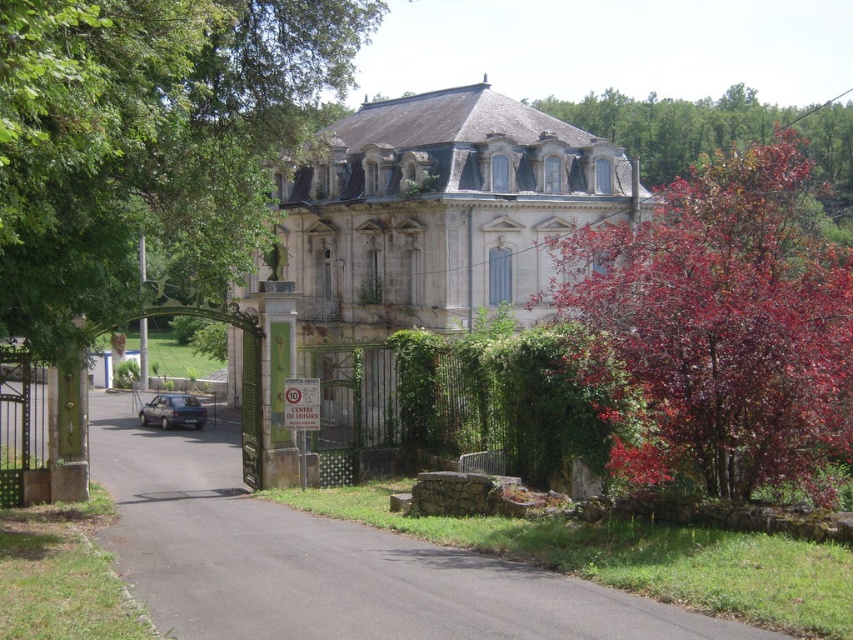
Who is more forward, (22, 276) or (183, 412)?

Positioned in front is point (22, 276).

Does green leafy tree at upper left have a lesser width compared to slate gray metallic hatchback at lower left?

Incorrect, green leafy tree at upper left's width is not less than slate gray metallic hatchback at lower left's.

Which is behind, point (38, 225) or point (141, 413)?

Point (141, 413)

Find the location of a particular element. Image resolution: width=853 pixels, height=640 pixels. green leafy tree at upper left is located at coordinates (148, 140).

Does point (199, 456) lie in front of point (194, 401)?

Yes, it is.

Is black asphalt driveway at center shorter than slate gray metallic hatchback at lower left?

Correct, black asphalt driveway at center is not as tall as slate gray metallic hatchback at lower left.

Who is more distant from viewer, (410, 630) or (181, 397)?

The point (181, 397) is behind.

This screenshot has width=853, height=640. In order to click on black asphalt driveway at center in this screenshot , I will do tap(328, 561).

Does green leafy tree at upper left have a greater height compared to purple leafy tree at upper right?

In fact, green leafy tree at upper left may be shorter than purple leafy tree at upper right.

Image resolution: width=853 pixels, height=640 pixels. What are the coordinates of `green leafy tree at upper left` in the screenshot? It's located at (148, 140).